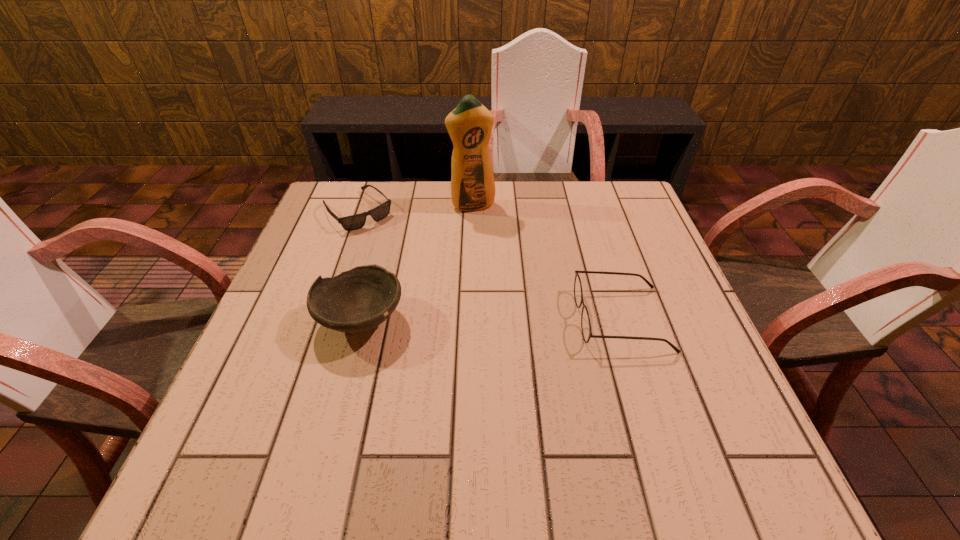
I want to click on vacant area that satisfies the following two spatial constraints: 1. on the front side of the sunglasses; 2. on the front-facing side of the third tallest object, so click(319, 319).